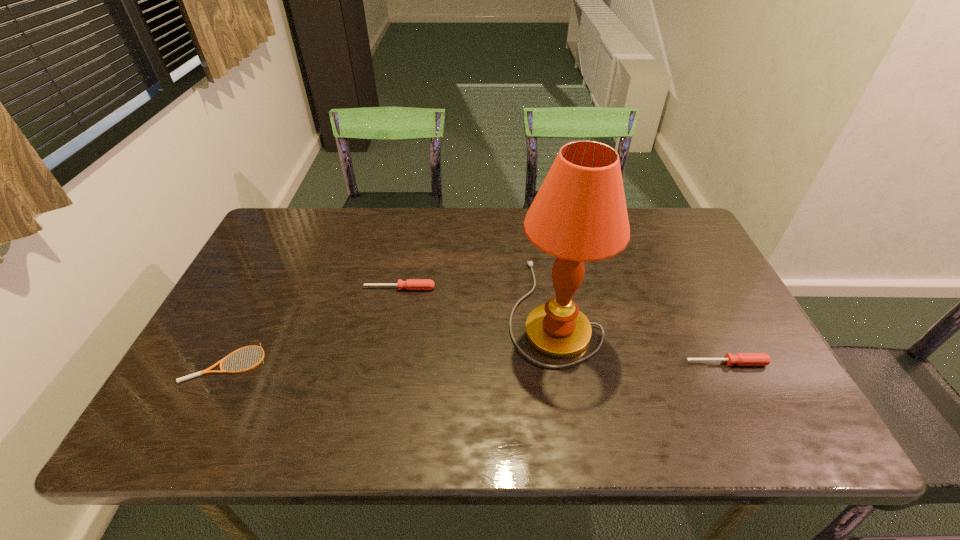
Locate an element on the screen. lamp is located at coordinates (579, 214).

The image size is (960, 540). I want to click on the third object from left to right, so click(579, 214).

I want to click on the second object from left to right, so click(x=410, y=284).

Where is `the left screwdriver`? This screenshot has height=540, width=960. the left screwdriver is located at coordinates coord(410,284).

I want to click on the rightmost object, so click(x=741, y=359).

Locate an element on the screen. This screenshot has width=960, height=540. the right screwdriver is located at coordinates (741, 359).

Where is `tennis racket`? tennis racket is located at coordinates pyautogui.click(x=221, y=361).

Image resolution: width=960 pixels, height=540 pixels. I want to click on the leftmost object, so click(221, 361).

Locate an element on the screen. vacant space located 0.240m on the right of the third object from left to right is located at coordinates (687, 309).

I want to click on vacant space situated 0.300m on the right of the third object from right to left, so click(542, 288).